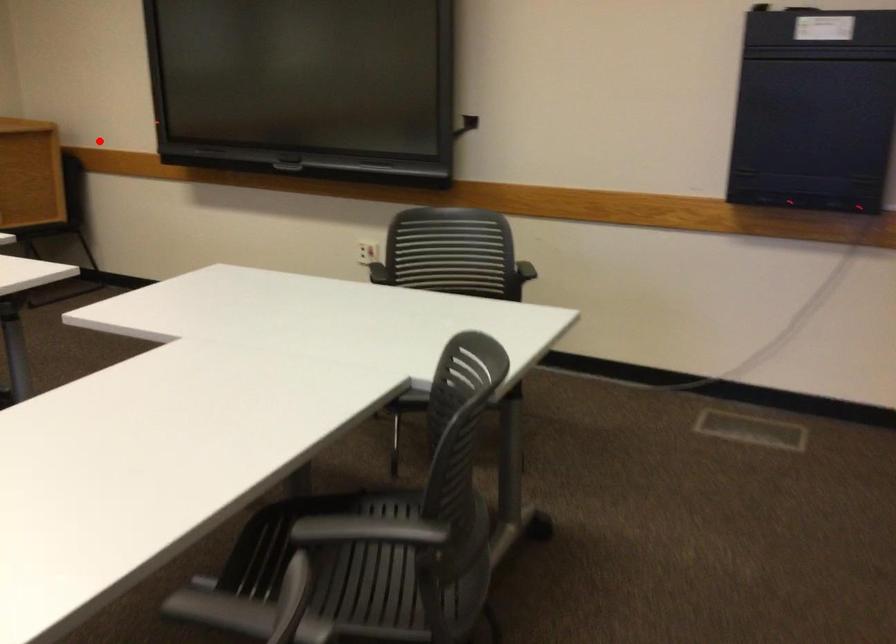
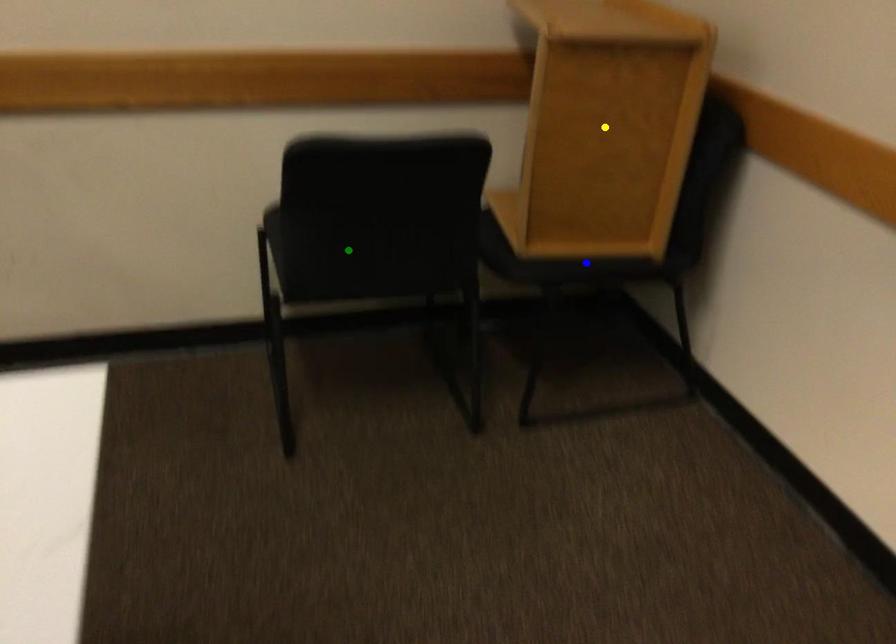
Question: I am providing you with two images of the same scene from different viewpoints. A red point is marked on the first image. You are given multiple points on the second image. Which spot in image 2 lines up with the point in image 1?

Choices:
 (A) blue point
 (B) green point
 (C) yellow point

Answer: (C)